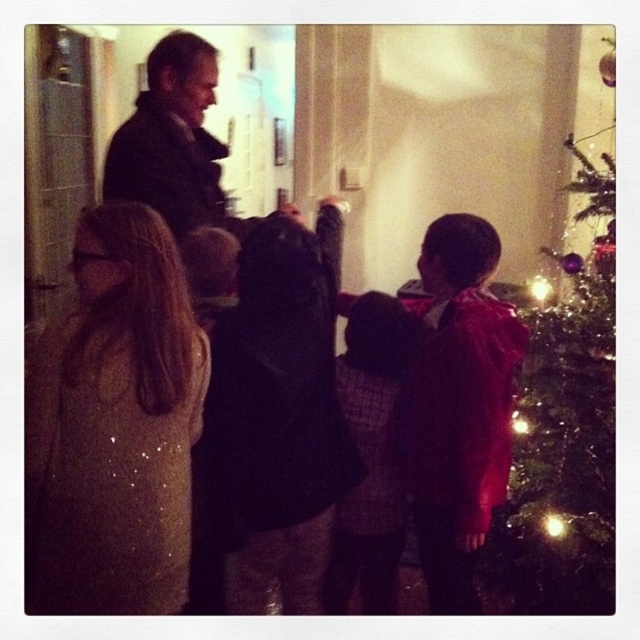
Question: Which object is positioned farthest from the dark wool coat at upper left?

Choices:
 (A) shiny sequined coat at center
 (B) shiny green tree at right
 (C) plaid fabric sweater at center

Answer: (B)

Question: Is shiny green tree at right in front of dark wool coat at upper left?

Choices:
 (A) yes
 (B) no

Answer: (A)

Question: Is shiny sequined coat at center below dark wool coat at upper left?

Choices:
 (A) yes
 (B) no

Answer: (A)

Question: Which point is farther to the camera?

Choices:
 (A) (166, 444)
 (B) (136, 122)
 (C) (376, 337)

Answer: (B)

Question: Is shiny sequined coat at center above dark wool coat at upper left?

Choices:
 (A) yes
 (B) no

Answer: (B)

Question: Which point appears farthest from the camera in this image?

Choices:
 (A) (156, 163)
 (B) (369, 502)
 (C) (125, 262)

Answer: (B)